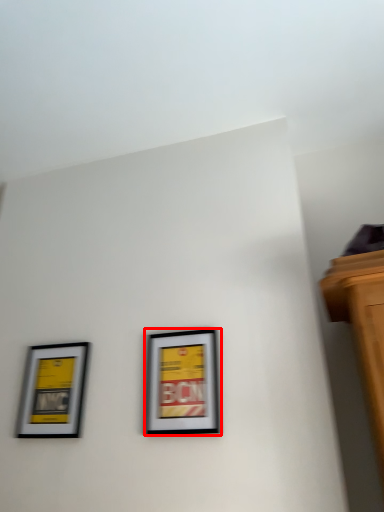
Question: Considering the relative positions of picture frame (annotated by the red box) and picture frame in the image provided, where is picture frame (annotated by the red box) located with respect to the staircase?

Choices:
 (A) right
 (B) left

Answer: (A)